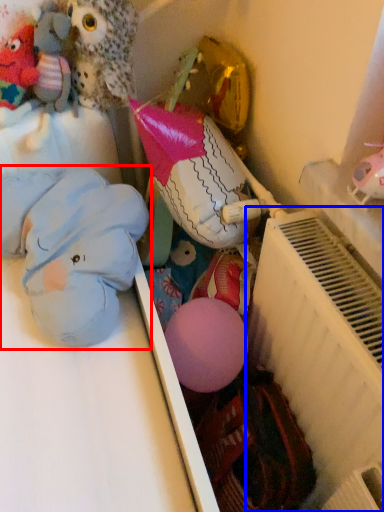
Question: Which object is further to the camera taking this photo, toy (highlighted by a red box) or radiator (highlighted by a blue box)?

Choices:
 (A) toy
 (B) radiator

Answer: (A)